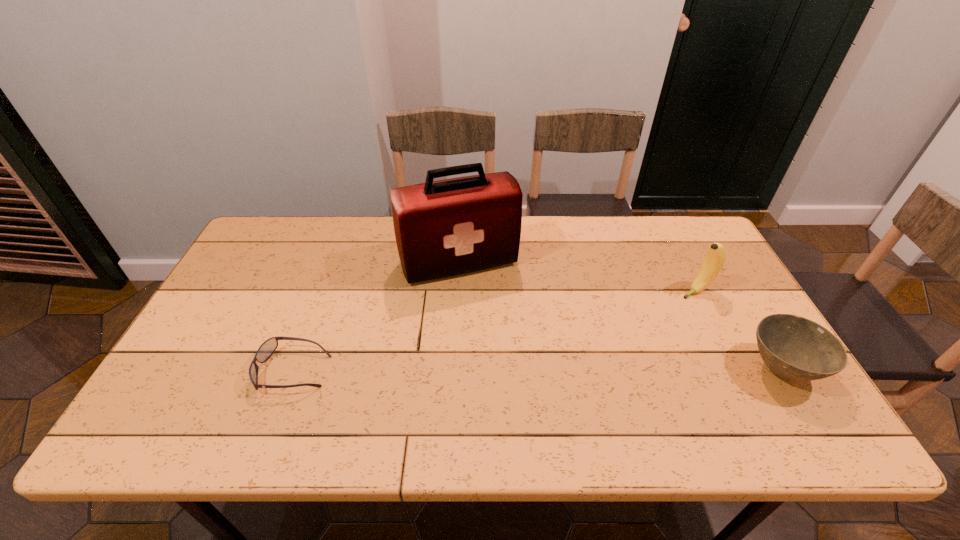
Image resolution: width=960 pixels, height=540 pixels. Find the location of `vacant space on the desktop that is between the leftmost object and the second shortest object and is positioned on the side of the first aid kit with the cross symbol`. vacant space on the desktop that is between the leftmost object and the second shortest object and is positioned on the side of the first aid kit with the cross symbol is located at coordinates (502, 370).

This screenshot has height=540, width=960. In order to click on vacant space on the desktop that is between the shortest object and the bowl and is positioned from the stem of the banana in this screenshot , I will do `click(545, 370)`.